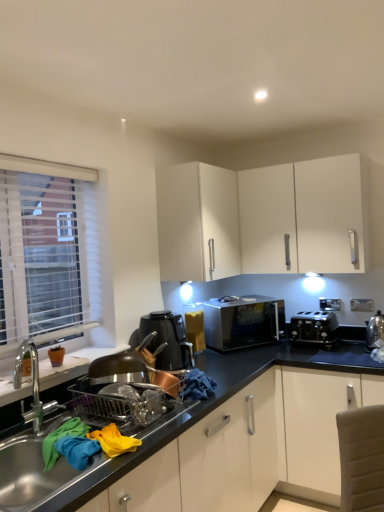
Question: From the image's perspective, is metallic stainless steel sink at lower left above or below black plastic kettle at center?

Choices:
 (A) above
 (B) below

Answer: (B)

Question: Is point (327, 396) closer or farther from the camera than point (170, 366)?

Choices:
 (A) farther
 (B) closer

Answer: (A)

Question: Considering the real-world distances, which object is closest to the black plastic toaster at lower right, the first appliance when ordered from back to front?

Choices:
 (A) satin silver microwave at center
 (B) satin silver kettle at right, which ranks as the second appliance in back-to-front order
 (C) white blinds at left
 (D) metallic stainless steel sink at lower left
 (E) black plastic kettle at center

Answer: (A)

Question: Which object is positioned farthest from the metallic stainless steel sink at lower left?

Choices:
 (A) white matte cabinet at upper center
 (B) satin silver kettle at right, the first appliance when ordered from front to back
 (C) white blinds at left
 (D) satin silver microwave at center
 (E) black plastic toaster at lower right, the first appliance when ordered from back to front

Answer: (C)